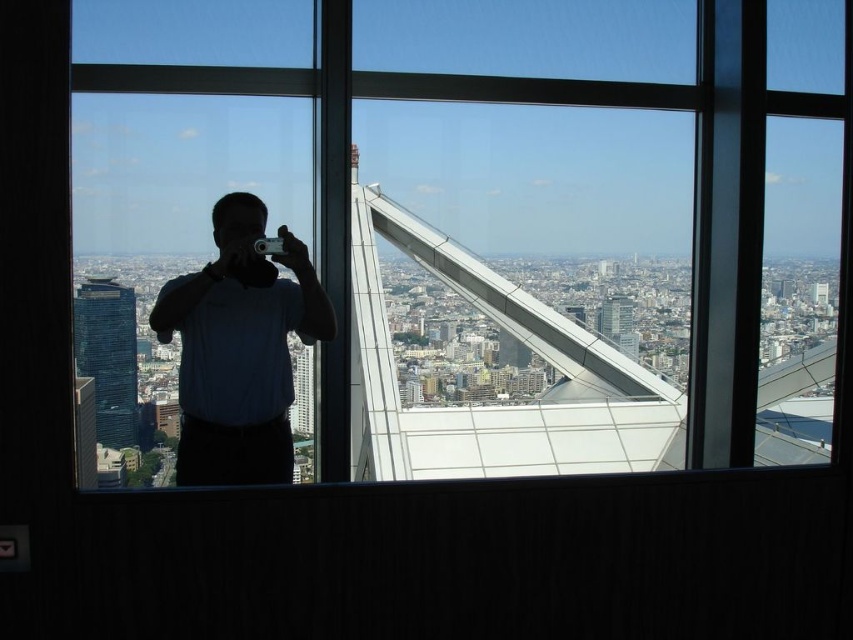
Question: Is transparent glass window at center below matte blue shirt at center?

Choices:
 (A) yes
 (B) no

Answer: (B)

Question: Which point is closer to the camera?

Choices:
 (A) transparent glass window at center
 (B) matte blue shirt at center

Answer: (A)

Question: Is transparent glass window at center smaller than matte blue shirt at center?

Choices:
 (A) yes
 (B) no

Answer: (B)

Question: Which object appears farthest from the camera in this image?

Choices:
 (A) transparent glass window at center
 (B) matte blue shirt at center

Answer: (B)

Question: Is transparent glass window at center thinner than matte blue shirt at center?

Choices:
 (A) no
 (B) yes

Answer: (A)